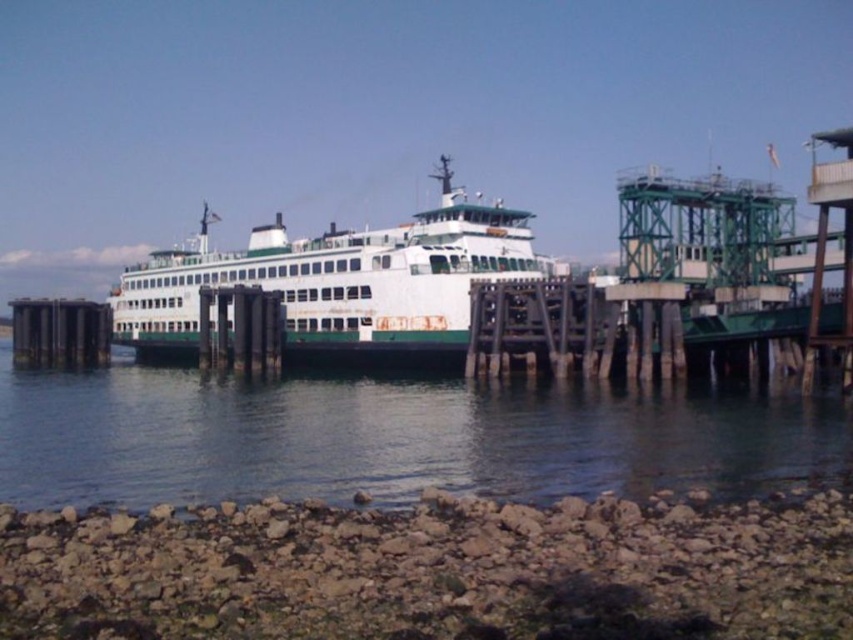
Can you confirm if clear water at center is shorter than white matte ferry at center?

Indeed, clear water at center has a lesser height compared to white matte ferry at center.

Is point (416, 404) farther from camera compared to point (351, 348)?

No, it is not.

Find the location of a particular element. clear water at center is located at coordinates (393, 438).